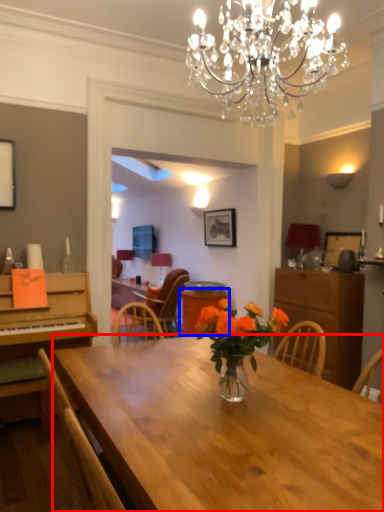
Question: Which object is further to the camera taking this photo, desk (highlighted by a red box) or table (highlighted by a blue box)?

Choices:
 (A) desk
 (B) table

Answer: (B)